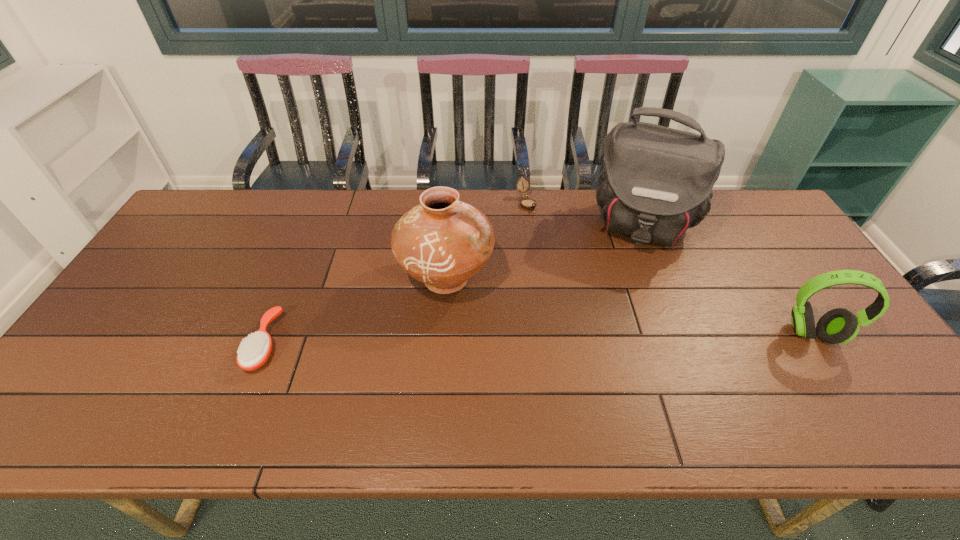
You are a GUI agent. You are given a task and a screenshot of the screen. Output one action in this format:
    pyautogui.click(x=<x>, y=<y>)
    Task: Click on the free spot on the desktop that is between the hairbrush and the third shortest object and is positioned on the face of the compass
    The image size is (960, 540).
    Given the screenshot: What is the action you would take?
    pyautogui.click(x=609, y=338)

This screenshot has width=960, height=540. Identify the location of free space on the desktop that is between the hairbrush and the third tallest object and is positioned on the side of the fourth shortest object with the handle. (564, 338).

The image size is (960, 540). What are the coordinates of `free space on the desktop that is between the hairbrush and the third tallest object and is positioned on the open flap of the shoulder bag` in the screenshot? It's located at (618, 338).